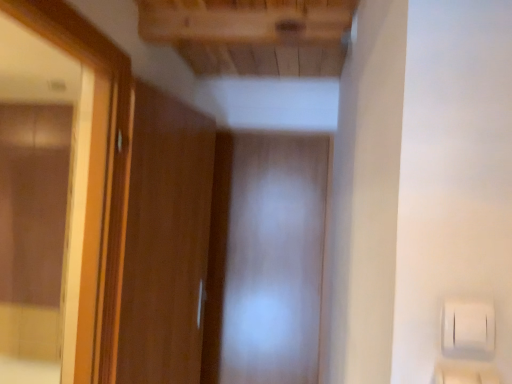
What is the approximate height of wooden frame mirror at left?

The height of wooden frame mirror at left is 4.06 feet.

In order to face wooden frame mirror at left, should I rotate leftwards or rightwards?

It's best to rotate left around 24.631 degrees.

What are the coordinates of `wooden door at left` in the screenshot? It's located at (165, 241).

Based on their sizes in the image, would you say transparent plastic screen door at center is bigger or smaller than wooden frame mirror at left?

Considering their sizes, transparent plastic screen door at center takes up less space than wooden frame mirror at left.

From the image's perspective, relative to wooden frame mirror at left, is transparent plastic screen door at center above or below?

transparent plastic screen door at center is below wooden frame mirror at left.

Is wooden frame mirror at left inside transparent plastic screen door at center?

No, transparent plastic screen door at center does not contain wooden frame mirror at left.

Measure the distance between wooden frame mirror at left and wooden door at left.

17.39 inches.

Considering the relative positions of wooden frame mirror at left and wooden door at left in the image provided, is wooden frame mirror at left to the right of wooden door at left from the viewer's perspective?

In fact, wooden frame mirror at left is to the left of wooden door at left.

Is wooden frame mirror at left smaller than wooden door at left?

No, wooden frame mirror at left is not smaller than wooden door at left.

From the image's perspective, which one is positioned lower, wooden door at left or transparent plastic screen door at center?

transparent plastic screen door at center.

Looking at their sizes, would you say wooden door at left is wider or thinner than transparent plastic screen door at center?

In the image, wooden door at left appears to be wider than transparent plastic screen door at center.

Is point (186, 255) positioned behind point (294, 173)?

No, it is in front of (294, 173).

Is wooden door at left inside or outside of transparent plastic screen door at center?

The correct answer is: outside.

Considering the positions of objects wooden frame mirror at left and transparent plastic screen door at center in the image provided, who is in front, wooden frame mirror at left or transparent plastic screen door at center?

Positioned in front is wooden frame mirror at left.

From the image's perspective, is wooden frame mirror at left located above or below transparent plastic screen door at center?

From the image's perspective, wooden frame mirror at left appears above transparent plastic screen door at center.

Is wooden frame mirror at left bigger than transparent plastic screen door at center?

Correct, wooden frame mirror at left is larger in size than transparent plastic screen door at center.

Who is shorter, wooden frame mirror at left or transparent plastic screen door at center?

wooden frame mirror at left.

Between wooden door at left and wooden frame mirror at left, which one has smaller width?

wooden door at left is thinner.

From the image's perspective, who appears lower, wooden door at left or wooden frame mirror at left?

From the image's view, wooden door at left is below.

This screenshot has height=384, width=512. Identify the location of door behind the wooden frame mirror at left. (165, 241).

What's the angular difference between wooden door at left and wooden frame mirror at left's facing directions?

The facing directions of wooden door at left and wooden frame mirror at left are 10.5 degrees apart.

Relative to wooden door at left, is transparent plastic screen door at center in front or behind?

transparent plastic screen door at center is positioned farther from the viewer than wooden door at left.

Is transparent plastic screen door at center far from wooden door at left?

transparent plastic screen door at center is near wooden door at left, not far away.

Can you tell me how much transparent plastic screen door at center and wooden door at left differ in facing direction?

The angular difference between transparent plastic screen door at center and wooden door at left is 77.4 degrees.

From the image's perspective, which one is positioned higher, transparent plastic screen door at center or wooden door at left?

From the image's view, wooden door at left is above.

Image resolution: width=512 pixels, height=384 pixels. I want to click on screen door located on the right of wooden frame mirror at left, so click(273, 260).

Where is `door below the wooden frame mirror at left (from the image's perspective)`? door below the wooden frame mirror at left (from the image's perspective) is located at coordinates (165, 241).

Which object lies nearer to the anchor point wooden door at left, transparent plastic screen door at center or wooden frame mirror at left?

Among the two, wooden frame mirror at left is located nearer to wooden door at left.

Looking at the image, which one is located further to transparent plastic screen door at center, wooden frame mirror at left or wooden door at left?

wooden frame mirror at left.

Looking at the image, which one is located closer to wooden frame mirror at left, wooden door at left or transparent plastic screen door at center?

Based on the image, wooden door at left appears to be nearer to wooden frame mirror at left.

Which object lies nearer to the anchor point wooden door at left, wooden frame mirror at left or transparent plastic screen door at center?

wooden frame mirror at left lies closer to wooden door at left than the other object.

From the image, which object appears to be nearer to transparent plastic screen door at center, wooden door at left or wooden frame mirror at left?

Among the two, wooden door at left is located nearer to transparent plastic screen door at center.

Looking at the image, which one is located further to wooden frame mirror at left, transparent plastic screen door at center or wooden door at left?

transparent plastic screen door at center is positioned further to the anchor wooden frame mirror at left.

Image resolution: width=512 pixels, height=384 pixels. I want to click on door between wooden frame mirror at left and transparent plastic screen door at center along the z-axis, so click(x=165, y=241).